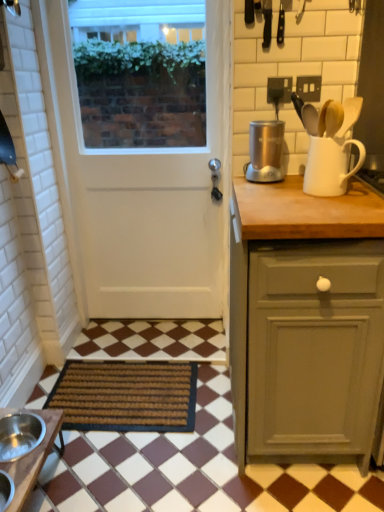
This screenshot has width=384, height=512. I want to click on white matte door at center, so click(150, 198).

What are the coordinates of `brown wooden table at lower left` in the screenshot? It's located at (31, 456).

In order to face white matte jug at upper right, should I rotate leftwards or rightwards?

A 17.231 degree turn to the right will do.

Where is `white matte door at center`? The image size is (384, 512). white matte door at center is located at coordinates [150, 198].

Is white matte door at center positioned with its back to brown wooden table at lower left?

No.

Is white matte door at center far from brown wooden table at lower left?

Indeed, white matte door at center is not near brown wooden table at lower left.

In the scene shown: Between white matte door at center and brown wooden table at lower left, which one has less height?

brown wooden table at lower left.

Visually, is satin silver appliance at upper right positioned to the left or to the right of matte gray cabinet at right?

In the image, satin silver appliance at upper right appears on the left side of matte gray cabinet at right.

Is satin silver appliance at upper right further to camera compared to matte gray cabinet at right?

Yes, it is behind matte gray cabinet at right.

From the image's perspective, does satin silver appliance at upper right appear higher than matte gray cabinet at right?

Yes, from the image's perspective, satin silver appliance at upper right is on top of matte gray cabinet at right.

Is point (258, 169) positioned behind point (368, 318)?

Yes, point (258, 169) is behind point (368, 318).

Is brown woven mat at lower left shorter than shiny metallic spoon at upper right?

Indeed, brown woven mat at lower left has a lesser height compared to shiny metallic spoon at upper right.

From a real-world perspective, which object stands above the other?

From a 3D spatial view, shiny metallic spoon at upper right is above.

Is brown woven mat at lower left bigger or smaller than shiny metallic spoon at upper right?

In the image, brown woven mat at lower left appears to be larger than shiny metallic spoon at upper right.

From the image's perspective, which object appears higher, brown woven mat at lower left or shiny metallic spoon at upper right?

shiny metallic spoon at upper right is shown above in the image.

Is matte gray cabinet at right inside white matte jug at upper right?

No, matte gray cabinet at right is not surrounded by white matte jug at upper right.

How far apart are white matte jug at upper right and matte gray cabinet at right?

17.56 inches.

Is matte gray cabinet at right at the back of white matte jug at upper right?

No, white matte jug at upper right is not facing away from matte gray cabinet at right.

Based on their sizes in the image, would you say white matte jug at upper right is bigger or smaller than matte gray cabinet at right?

In the image, white matte jug at upper right appears to be smaller than matte gray cabinet at right.

Identify the location of table on the left side of satin silver appliance at upper right. (31, 456).

From the image's perspective, is satin silver appliance at upper right beneath brown wooden table at lower left?

No.

From a real-world perspective, which object rests below the other?

brown wooden table at lower left, from a real-world perspective.

Is satin silver appliance at upper right positioned beyond the bounds of brown wooden table at lower left?

Indeed, satin silver appliance at upper right is completely outside brown wooden table at lower left.

Is shiny metallic spoon at upper right to the left or to the right of white matte jug at upper right in the image?

Based on their positions, shiny metallic spoon at upper right is located to the left of white matte jug at upper right.

Looking at this image, considering the sizes of objects shiny metallic spoon at upper right and white matte jug at upper right in the image provided, who is shorter, shiny metallic spoon at upper right or white matte jug at upper right?

Standing shorter between the two is shiny metallic spoon at upper right.

Is shiny metallic spoon at upper right aimed at white matte jug at upper right?

No, shiny metallic spoon at upper right is not turned towards white matte jug at upper right.

From a real-world perspective, between matte gray cabinet at right and brown woven mat at lower left, who is vertically higher?

From a 3D spatial view, matte gray cabinet at right is above.

Visually, is matte gray cabinet at right positioned to the left or to the right of brown woven mat at lower left?

Clearly, matte gray cabinet at right is on the right of brown woven mat at lower left in the image.

Looking at this image, choose the correct answer: Is matte gray cabinet at right inside brown woven mat at lower left or outside it?

matte gray cabinet at right is not inside brown woven mat at lower left, it's outside.

Where is `table on the left of white matte door at center`? This screenshot has height=512, width=384. table on the left of white matte door at center is located at coordinates (31, 456).

At what (x,y) coordinates should I click in order to perform the action: click on kitchen appliance that is above the matte gray cabinet at right (from a real-world perspective). Please return your answer as a coordinate pair (x, y). The height and width of the screenshot is (512, 384). Looking at the image, I should click on (265, 152).

In the scene shown: Based on their spatial positions, is matte gray cabinet at right or white matte jug at upper right closer to brown woven mat at lower left?

The object closer to brown woven mat at lower left is matte gray cabinet at right.

Based on their spatial positions, is brown woven mat at lower left or matte gray cabinet at right further from shiny metallic spoon at upper right?

Based on the image, brown woven mat at lower left appears to be further to shiny metallic spoon at upper right.

Considering their positions, is white matte jug at upper right positioned further to matte gray cabinet at right than white matte door at center?

white matte door at center lies further to matte gray cabinet at right than the other object.

Looking at the image, which one is located further to matte gray cabinet at right, white matte door at center or brown wooden table at lower left?

brown wooden table at lower left.

Which object lies further to the anchor point white matte jug at upper right, matte gray cabinet at right or white matte door at center?

Based on the image, white matte door at center appears to be further to white matte jug at upper right.

When comparing their distances from white matte jug at upper right, does satin silver appliance at upper right or matte gray cabinet at right seem closer?

satin silver appliance at upper right is closer to white matte jug at upper right.

From the image, which object appears to be farther from brown wooden table at lower left, white matte door at center or white matte jug at upper right?

white matte jug at upper right is positioned further to the anchor brown wooden table at lower left.

Looking at the image, which one is located closer to brown wooden table at lower left, white matte jug at upper right or satin silver appliance at upper right?

satin silver appliance at upper right is closer to brown wooden table at lower left.

Where is `door that lies between satin silver appliance at upper right and brown wooden table at lower left from top to bottom`? door that lies between satin silver appliance at upper right and brown wooden table at lower left from top to bottom is located at coordinates coord(150,198).

Where is `door between shiny metallic spoon at upper right and brown woven mat at lower left in the up-down direction`? door between shiny metallic spoon at upper right and brown woven mat at lower left in the up-down direction is located at coordinates (150, 198).

Where is `cabinetry between shiny metallic spoon at upper right and brown woven mat at lower left from top to bottom`? The height and width of the screenshot is (512, 384). cabinetry between shiny metallic spoon at upper right and brown woven mat at lower left from top to bottom is located at coordinates (314, 350).

Find the location of a particular element. This screenshot has height=512, width=384. cabinetry between brown wooden table at lower left and white matte jug at upper right from left to right is located at coordinates (314, 350).